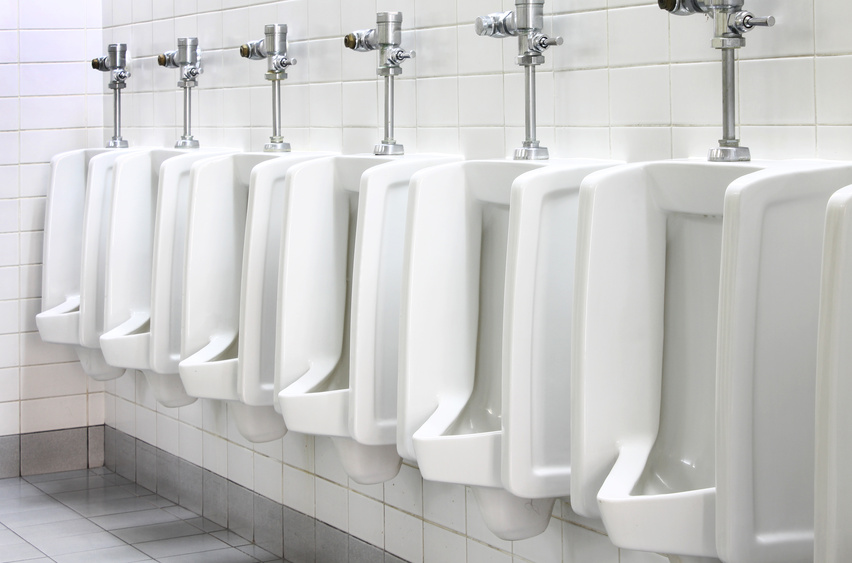
The image size is (852, 563). I want to click on urinal, so (72, 225), (131, 260), (204, 263), (296, 292), (413, 325), (652, 397), (482, 366), (799, 428).